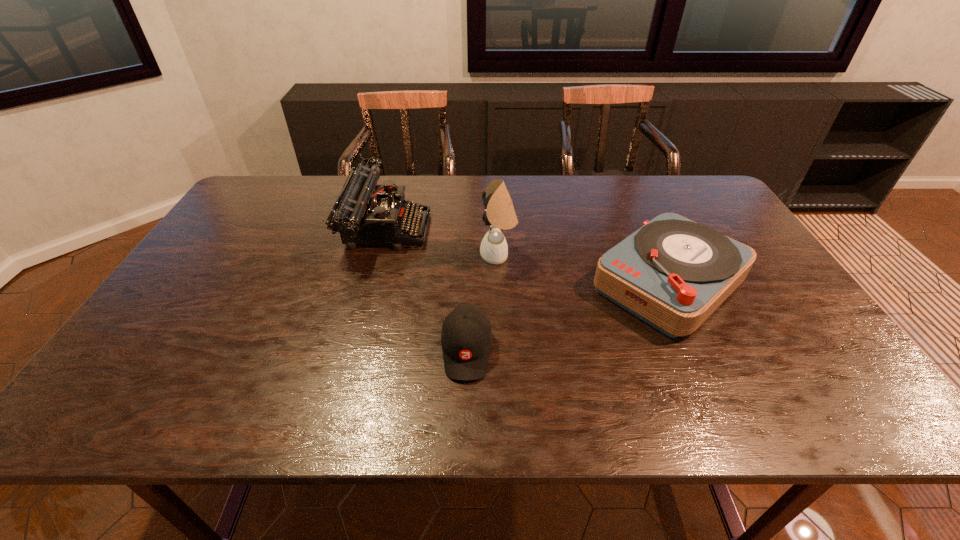
The width and height of the screenshot is (960, 540). In order to click on doll in this screenshot , I will do `click(500, 212)`.

Find the location of a particular element. The height and width of the screenshot is (540, 960). the leftmost object is located at coordinates point(362,216).

Locate an element on the screen. the second tallest object is located at coordinates (362, 216).

At what (x,y) coordinates should I click in order to perform the action: click on the second shortest object. Please return your answer as a coordinate pair (x, y). The image size is (960, 540). Looking at the image, I should click on (673, 273).

This screenshot has height=540, width=960. Identify the location of the rightmost object. (673, 273).

What are the coordinates of `the shortest object` in the screenshot? It's located at (466, 337).

The image size is (960, 540). Find the location of `free space located at the front face of the tallest object`. free space located at the front face of the tallest object is located at coordinates (383, 255).

I want to click on vacant space situated 0.380m at the front face of the tallest object, so click(348, 255).

The width and height of the screenshot is (960, 540). Find the location of `vacant space located at the front face of the tallest object`. vacant space located at the front face of the tallest object is located at coordinates (418, 255).

This screenshot has height=540, width=960. I want to click on vacant space located on the keyboard of the leftmost object, so click(525, 228).